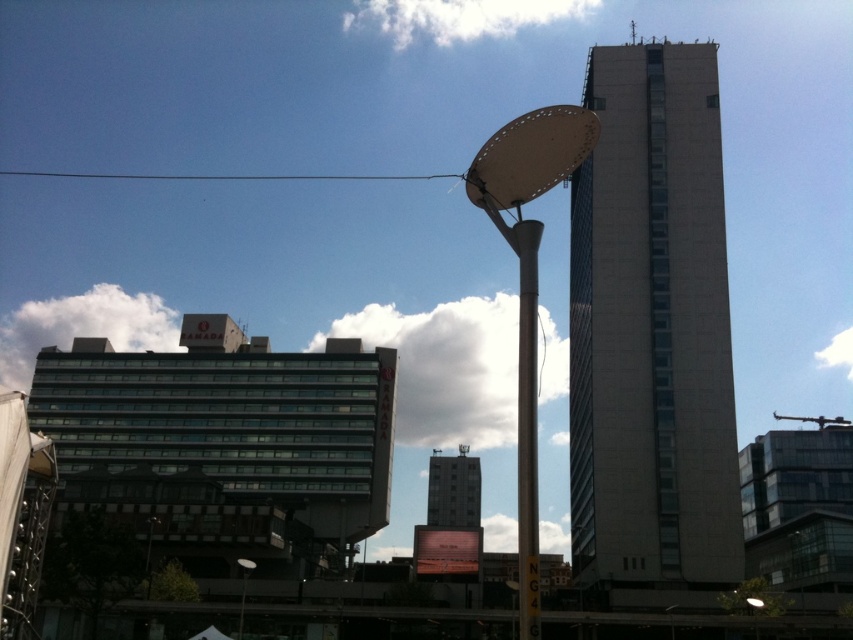
You are standing at the point labeled as point (527, 284) in the urban scene. Which object are you touching?

You are touching the white matte lamp post at center because the point (527, 284) is located on it.

You are a city planner analyzing the urban layout. You need to install a new streetlight that is exactly the same size as the metallic satellite dish at upper center. Based on the image, can the existing white matte lamp post at center be used as a reference for the new streetlight? Explain your reasoning.

Result: The white matte lamp post at center has a width larger than the metallic satellite dish at upper center. Therefore, the existing white matte lamp post at center cannot be used as a reference for the new streetlight since its width is greater than the required size of the satellite dish.

You are a delivery person trying to navigate through the city. You see the white matte lamp post at center and the metallic satellite dish at upper center. Which object is positioned to the left?

The white matte lamp post at center is to the left of the metallic satellite dish at upper center, so the white matte lamp post at center is positioned to the left.